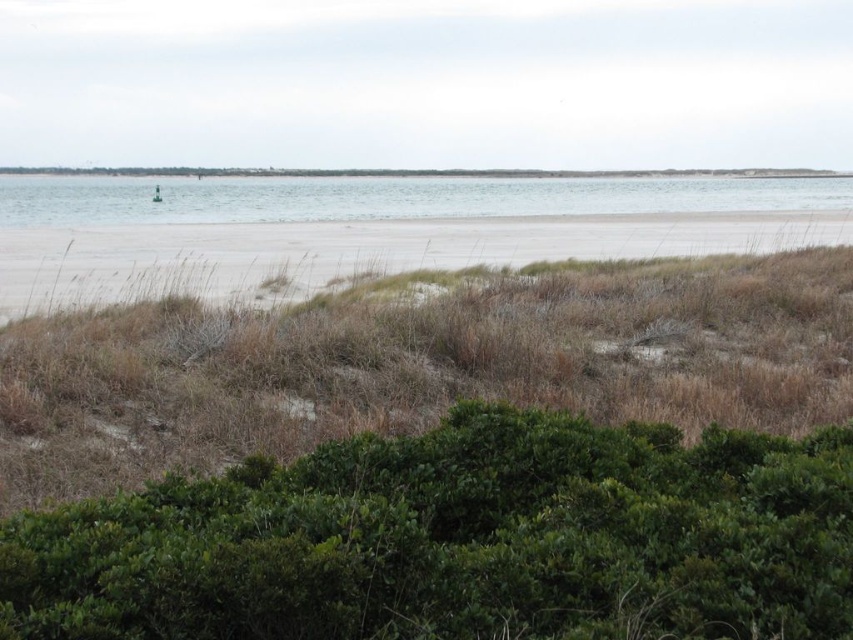
Question: Is green leafy bush at lower center above light beige sand at center?

Choices:
 (A) no
 (B) yes

Answer: (A)

Question: Is light beige sand at center wider than clear water at center?

Choices:
 (A) no
 (B) yes

Answer: (A)

Question: Which of these objects is positioned closest to the clear water at center?

Choices:
 (A) green leafy bush at lower center
 (B) light beige sand at center

Answer: (B)

Question: Which of the following is the closest to the observer?

Choices:
 (A) light beige sand at center
 (B) green leafy bush at lower center

Answer: (B)

Question: Which of the following is the farthest from the observer?

Choices:
 (A) light beige sand at center
 (B) green leafy bush at lower center

Answer: (A)

Question: Does green leafy bush at lower center appear on the right side of light beige sand at center?

Choices:
 (A) yes
 (B) no

Answer: (B)